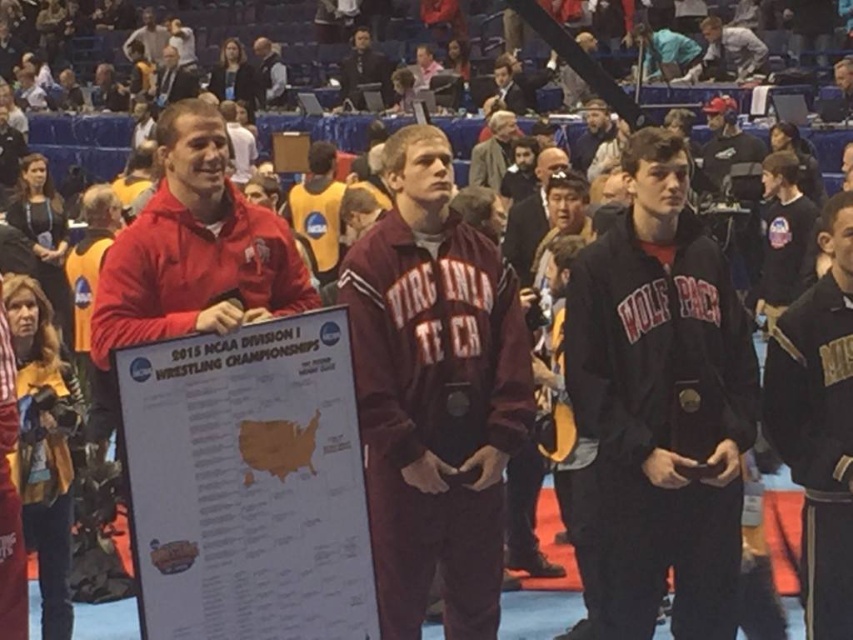
From the picture: You are a photographer standing at the front of the arena and want to take a closeup photo of the wooden plaque at center. The camera you are using has a minimum focusing distance of 2 meters. Can you take the photo without moving closer?

The wooden plaque at center is 4.79 meters from viewer, which is beyond the camera minimum focusing distance of 2 meters. Therefore, you can take the photo without moving closer.

You are attending the NCAA Wrestling Championships and notice two items in the center of the scene. Which item is taller, the wooden plaque at center or the light blue shirt at center?

The wooden plaque at center is much taller than the light blue shirt at center.